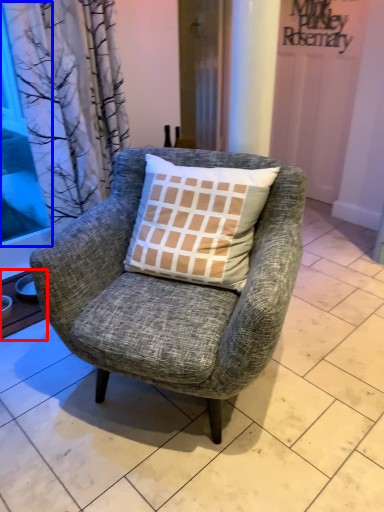
Question: Which of the following is the farthest to the observer, window sill (highlighted by a red box) or window screen (highlighted by a blue box)?

Choices:
 (A) window sill
 (B) window screen

Answer: (A)